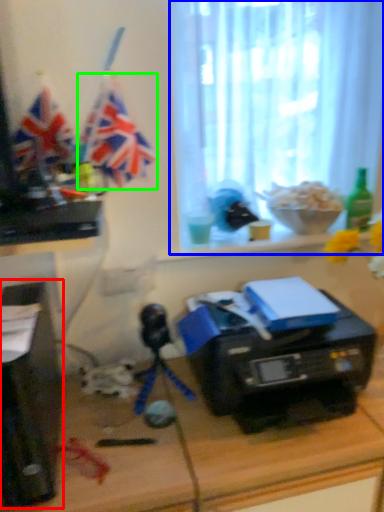
Question: Which is farther away from desktop computer (highlighted by a red box)? window screen (highlighted by a blue box) or flag (highlighted by a green box)?

Choices:
 (A) window screen
 (B) flag

Answer: (A)